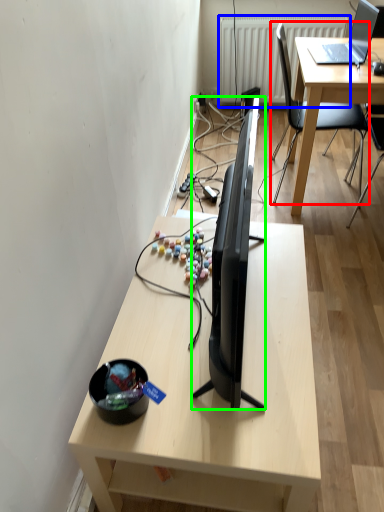
Question: Considering the real-world distances, which object is closest to chair (highlighted by a red box)? radiator (highlighted by a blue box) or television (highlighted by a green box).

Choices:
 (A) radiator
 (B) television

Answer: (A)